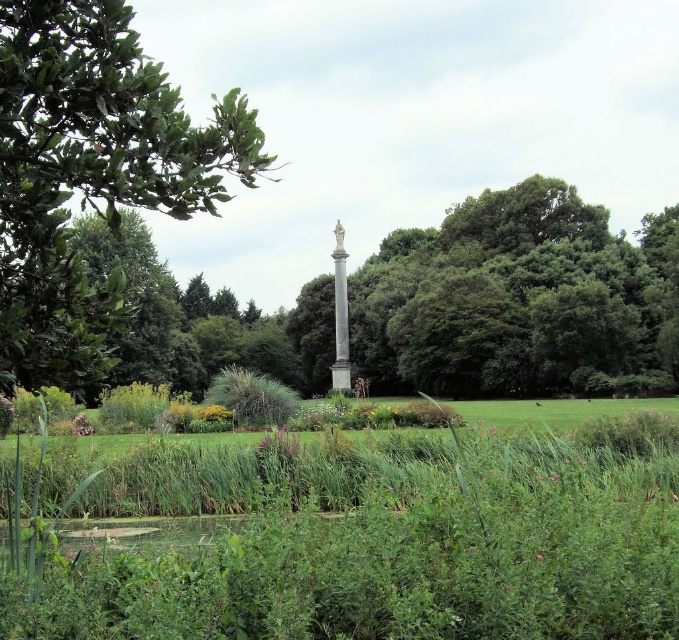
Who is lower down, green grassy field at center or green leafy tree at upper left?

Positioned lower is green grassy field at center.

Can you confirm if green grassy field at center is wider than green leafy tree at upper left?

No, green grassy field at center is not wider than green leafy tree at upper left.

What do you see at coordinates (378, 540) in the screenshot?
I see `green grassy field at center` at bounding box center [378, 540].

Identify the location of green grassy field at center. The image size is (679, 640). (378, 540).

Does green grassy field at center have a smaller size compared to white marble column at center?

No, green grassy field at center is not smaller than white marble column at center.

Is green grassy field at center behind white marble column at center?

No, it is in front of white marble column at center.

Describe the element at coordinates (378, 540) in the screenshot. The width and height of the screenshot is (679, 640). I see `green grassy field at center` at that location.

The image size is (679, 640). In order to click on green grassy field at center in this screenshot , I will do `click(378, 540)`.

Does green leafy tree at upper left appear on the right side of white marble column at center?

In fact, green leafy tree at upper left is to the left of white marble column at center.

Is green leafy tree at upper left taller than white marble column at center?

Yes.

The height and width of the screenshot is (640, 679). I want to click on green leafy tree at upper left, so [91, 173].